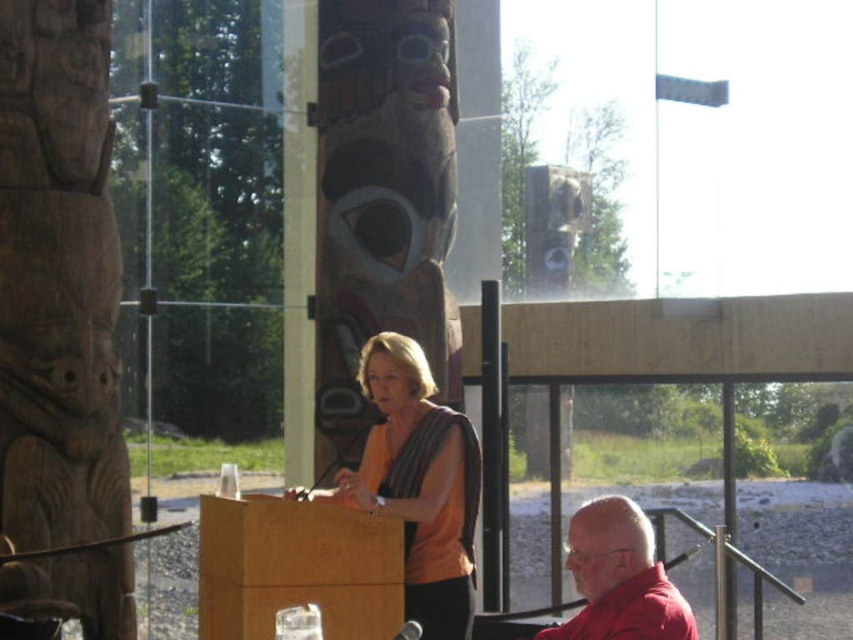
Question: Where is wooden totem pole at left located in relation to orange matte shirt at center in the image?

Choices:
 (A) below
 (B) above

Answer: (B)

Question: Is orange matte shirt at center behind red matte shirt at lower right?

Choices:
 (A) no
 (B) yes

Answer: (B)

Question: Estimate the real-world distances between objects in this image. Which object is closer to the orange matte shirt at center?

Choices:
 (A) red matte shirt at lower right
 (B) wooden totem pole at left

Answer: (A)

Question: Which of these objects is positioned farthest from the wooden totem pole at left?

Choices:
 (A) red matte shirt at lower right
 (B) orange matte shirt at center
 (C) wooden totem pole at center

Answer: (A)

Question: Is wooden totem pole at left thinner than orange matte shirt at center?

Choices:
 (A) no
 (B) yes

Answer: (A)

Question: Which point is farther to the camera?

Choices:
 (A) wooden totem pole at center
 (B) red matte shirt at lower right

Answer: (A)